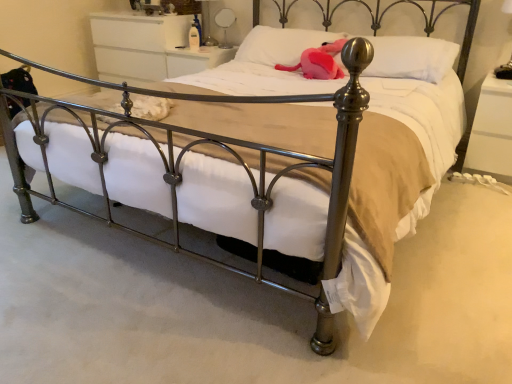
Describe the element at coordinates (281, 44) in the screenshot. I see `white soft pillow at upper center, which is counted as the 2th pillow, starting from the right` at that location.

Describe the element at coordinates (148, 48) in the screenshot. I see `white glossy dresser at upper center, which appears as the second nightstand when viewed from the front` at that location.

The image size is (512, 384). In order to click on pink plush toy at center in this screenshot , I will do `click(319, 62)`.

What is the approximate width of pink plush toy at center?

16.47 inches.

At what (x,y) coordinates should I click in order to perform the action: click on white soft pillow at upper center, the 1th pillow from the right. Please return your answer as a coordinate pair (x, y). Looking at the image, I should click on (411, 58).

Considering the sizes of objects metallic silver table lamp at upper right, which is the 1th table lamp in right-to-left order, and white glossy nightstand at right, the first nightstand positioned from the front, in the image provided, who is smaller, metallic silver table lamp at upper right, which is the 1th table lamp in right-to-left order, or white glossy nightstand at right, the first nightstand positioned from the front,?

Smaller between the two is metallic silver table lamp at upper right, which is the 1th table lamp in right-to-left order.

Can you confirm if metallic silver table lamp at upper right, positioned as the first table lamp in front-to-back order, is wider than white glossy nightstand at right, the first nightstand positioned from the front?

In fact, metallic silver table lamp at upper right, positioned as the first table lamp in front-to-back order, might be narrower than white glossy nightstand at right, the first nightstand positioned from the front.

From the image's perspective, does metallic silver table lamp at upper right, which is the second table lamp from top to bottom, appear higher than white glossy nightstand at right, the first nightstand positioned from the front?

Correct, metallic silver table lamp at upper right, which is the second table lamp from top to bottom, appears higher than white glossy nightstand at right, the first nightstand positioned from the front, in the image.

Which object is positioned more to the left, metallic silver table lamp at upper right, marked as the second table lamp in a back-to-front arrangement, or white glossy nightstand at right, the 1th nightstand when ordered from bottom to top?

From the viewer's perspective, metallic silver table lamp at upper right, marked as the second table lamp in a back-to-front arrangement, appears more on the left side.

Is metallic silver table lamp at upper center, which is counted as the first table lamp, starting from the left, not close to white soft pillow at upper center, which is counted as the second pillow, starting from the left?

Yes, metallic silver table lamp at upper center, which is counted as the first table lamp, starting from the left, and white soft pillow at upper center, which is counted as the second pillow, starting from the left, are quite far apart.

Is metallic silver table lamp at upper center, the 2th table lamp in the bottom-to-top sequence, turned away from white soft pillow at upper center, the 1th pillow from the right?

No, metallic silver table lamp at upper center, the 2th table lamp in the bottom-to-top sequence,'s orientation is not away from white soft pillow at upper center, the 1th pillow from the right.

Would you say metallic silver table lamp at upper center, arranged as the 1th table lamp when viewed from the top, is outside white soft pillow at upper center, which is counted as the second pillow, starting from the left?

Yes, metallic silver table lamp at upper center, arranged as the 1th table lamp when viewed from the top, is located beyond the bounds of white soft pillow at upper center, which is counted as the second pillow, starting from the left.

Does point (209, 31) lie in front of point (414, 68)?

No, (209, 31) is behind (414, 68).

Does metallic silver table lamp at upper right, which ranks as the first table lamp in bottom-to-top order, turn towards metallic silver table lamp at upper center, which is the 2th table lamp from front to back?

No, metallic silver table lamp at upper right, which ranks as the first table lamp in bottom-to-top order, is not aimed at metallic silver table lamp at upper center, which is the 2th table lamp from front to back.

Is metallic silver table lamp at upper right, which is the second table lamp from top to bottom, at the left side of metallic silver table lamp at upper center, which is counted as the first table lamp, starting from the left?

Incorrect, metallic silver table lamp at upper right, which is the second table lamp from top to bottom, is not on the left side of metallic silver table lamp at upper center, which is counted as the first table lamp, starting from the left.

In the scene shown: From a real-world perspective, who is located lower, metallic silver table lamp at upper right, marked as the second table lamp in a back-to-front arrangement, or metallic silver table lamp at upper center, which is the first table lamp in back-to-front order?

metallic silver table lamp at upper center, which is the first table lamp in back-to-front order.

Is metallic silver table lamp at upper right, positioned as the first table lamp in front-to-back order, inside or outside of metallic silver table lamp at upper center, the 2th table lamp in the bottom-to-top sequence?

The correct answer is: outside.

How different are the orientations of metallic silver table lamp at upper center, the 2th table lamp in the bottom-to-top sequence, and white soft pillow at upper center, acting as the 1th pillow starting from the left, in degrees?

3.68 degrees separate the facing orientations of metallic silver table lamp at upper center, the 2th table lamp in the bottom-to-top sequence, and white soft pillow at upper center, acting as the 1th pillow starting from the left.

Choose the correct answer: Is metallic silver table lamp at upper center, which is counted as the first table lamp, starting from the left, inside white soft pillow at upper center, which is counted as the 2th pillow, starting from the right, or outside it?

metallic silver table lamp at upper center, which is counted as the first table lamp, starting from the left, lies outside white soft pillow at upper center, which is counted as the 2th pillow, starting from the right.

Based on their positions, is metallic silver table lamp at upper center, which is counted as the first table lamp, starting from the left, located to the left or right of white soft pillow at upper center, which is counted as the 2th pillow, starting from the right?

Clearly, metallic silver table lamp at upper center, which is counted as the first table lamp, starting from the left, is on the left of white soft pillow at upper center, which is counted as the 2th pillow, starting from the right, in the image.

From the image's perspective, between metallic silver table lamp at upper center, which is counted as the first table lamp, starting from the left, and white soft pillow at upper center, which is counted as the 2th pillow, starting from the right, which one is located above?

metallic silver table lamp at upper center, which is counted as the first table lamp, starting from the left, from the image's perspective.

From their relative heights in the image, would you say white glossy nightstand at right, the 2th nightstand positioned from the left, is taller or shorter than white soft pillow at upper center, acting as the 1th pillow starting from the left?

Clearly, white glossy nightstand at right, the 2th nightstand positioned from the left, is taller compared to white soft pillow at upper center, acting as the 1th pillow starting from the left.

Is white glossy nightstand at right, the 2th nightstand positioned from the left, bigger or smaller than white soft pillow at upper center, acting as the 1th pillow starting from the left?

Considering their sizes, white glossy nightstand at right, the 2th nightstand positioned from the left, takes up more space than white soft pillow at upper center, acting as the 1th pillow starting from the left.

Are white glossy nightstand at right, the 1th nightstand when ordered from bottom to top, and white soft pillow at upper center, which is counted as the 2th pillow, starting from the right, located far from each other?

white glossy nightstand at right, the 1th nightstand when ordered from bottom to top, is far away from white soft pillow at upper center, which is counted as the 2th pillow, starting from the right.

From a real-world perspective, is white glossy nightstand at right, the first nightstand positioned from the front, above or below white soft pillow at upper center, acting as the 1th pillow starting from the left?

white glossy nightstand at right, the first nightstand positioned from the front, is below white soft pillow at upper center, acting as the 1th pillow starting from the left.

Which of these two, pink plush toy at center or metallic silver table lamp at upper right, positioned as the first table lamp in front-to-back order, is smaller?

metallic silver table lamp at upper right, positioned as the first table lamp in front-to-back order.

Is pink plush toy at center looking in the opposite direction of metallic silver table lamp at upper right, positioned as the first table lamp in front-to-back order?

No.

Consider the image. Which is correct: pink plush toy at center is inside metallic silver table lamp at upper right, marked as the second table lamp in a back-to-front arrangement, or outside of it?

pink plush toy at center cannot be found inside metallic silver table lamp at upper right, marked as the second table lamp in a back-to-front arrangement.

How many degrees apart are the facing directions of pink plush toy at center and metallic silver table lamp at upper right, which is the 1th table lamp in right-to-left order?

The facing directions of pink plush toy at center and metallic silver table lamp at upper right, which is the 1th table lamp in right-to-left order, are 9.26 degrees apart.

Is metallic silver table lamp at upper center, positioned as the 2th table lamp in right-to-left order, not inside white glossy dresser at upper center, which is the 2th nightstand from right to left?

Yes, metallic silver table lamp at upper center, positioned as the 2th table lamp in right-to-left order, is not within white glossy dresser at upper center, which is the 2th nightstand from right to left.

From the image's perspective, between metallic silver table lamp at upper center, positioned as the 2th table lamp in right-to-left order, and white glossy dresser at upper center, which appears as the second nightstand when viewed from the front, which one is located above?

metallic silver table lamp at upper center, positioned as the 2th table lamp in right-to-left order, appears higher in the image.

The width and height of the screenshot is (512, 384). In order to click on the 1st table lamp positioned above the white glossy dresser at upper center, which is the 2th nightstand from right to left (from a real-world perspective) in this screenshot , I will do `click(206, 23)`.

Is metallic silver table lamp at upper center, which is the first table lamp in back-to-front order, shorter than white glossy dresser at upper center, which is the 2th nightstand from right to left?

Yes.

Starting from the white glossy nightstand at right, acting as the 2th nightstand starting from the top, which table lamp is the 1st one to the left? Please provide its 2D coordinates.

[(504, 70)]

Locate an element on the screen. The height and width of the screenshot is (384, 512). pillow that is the 2nd one when counting downward from the metallic silver table lamp at upper center, which is the first table lamp in back-to-front order (from the image's perspective) is located at coordinates (411, 58).

Looking at the image, which one is located closer to white glossy nightstand at right, the 2th nightstand positioned from the left, pink plush toy at center or white soft pillow at upper center, acting as the 1th pillow starting from the left?

pink plush toy at center is positioned closer to the anchor white glossy nightstand at right, the 2th nightstand positioned from the left.

Looking at the image, which one is located closer to pink plush toy at center, metallic silver table lamp at upper center, positioned as the 2th table lamp in right-to-left order, or metallic silver table lamp at upper right, positioned as the first table lamp in front-to-back order?

metallic silver table lamp at upper right, positioned as the first table lamp in front-to-back order, is positioned closer to the anchor pink plush toy at center.

From the picture: Considering their positions, is white soft pillow at upper center, the 1th pillow from the right, positioned closer to white glossy dresser at upper center, which is counted as the second nightstand, starting from the bottom, than white soft pillow at upper center, which is counted as the 2th pillow, starting from the right?

Based on the image, white soft pillow at upper center, which is counted as the 2th pillow, starting from the right, appears to be nearer to white glossy dresser at upper center, which is counted as the second nightstand, starting from the bottom.

From the image, which object appears to be farther from white soft pillow at upper center, which is counted as the second pillow, starting from the left, metallic silver table lamp at upper right, marked as the second table lamp in a back-to-front arrangement, or metallic silver table lamp at upper center, which is counted as the first table lamp, starting from the left?

metallic silver table lamp at upper center, which is counted as the first table lamp, starting from the left, is further to white soft pillow at upper center, which is counted as the second pillow, starting from the left.

Looking at the image, which one is located further to white glossy dresser at upper center, positioned as the 1th nightstand in left-to-right order, metallic silver table lamp at upper center, positioned as the 2th table lamp in right-to-left order, or white glossy nightstand at right, the 2th nightstand positioned from the left?

Based on the image, white glossy nightstand at right, the 2th nightstand positioned from the left, appears to be further to white glossy dresser at upper center, positioned as the 1th nightstand in left-to-right order.

Estimate the real-world distances between objects in this image. Which object is closer to white soft pillow at upper center, acting as the 1th pillow starting from the left, metallic silver table lamp at upper right, positioned as the 2th table lamp in left-to-right order, or white glossy dresser at upper center, acting as the 1th nightstand starting from the top?

white glossy dresser at upper center, acting as the 1th nightstand starting from the top, lies closer to white soft pillow at upper center, acting as the 1th pillow starting from the left, than the other object.

Which object lies further to the anchor point white glossy nightstand at right, the 2th nightstand positioned from the left, white soft pillow at upper center, which is counted as the second pillow, starting from the left, or metallic silver table lamp at upper center, arranged as the 1th table lamp when viewed from the top?

metallic silver table lamp at upper center, arranged as the 1th table lamp when viewed from the top, is further to white glossy nightstand at right, the 2th nightstand positioned from the left.

Which object lies further to the anchor point white glossy dresser at upper center, which is the 2th nightstand from right to left, metallic silver table lamp at upper center, positioned as the 2th table lamp in right-to-left order, or pink plush toy at center?

Among the two, pink plush toy at center is located further to white glossy dresser at upper center, which is the 2th nightstand from right to left.

You are a GUI agent. You are given a task and a screenshot of the screen. Output one action in this format:
    pyautogui.click(x=<x>, y=<y>)
    Task: Click on the pillow between white soft pillow at upper center, acting as the 1th pillow starting from the left, and white glossy nightstand at right, acting as the 2th nightstand starting from the top
    This screenshot has height=384, width=512.
    Given the screenshot: What is the action you would take?
    pyautogui.click(x=411, y=58)

At what (x,y) coordinates should I click in order to perform the action: click on table lamp situated between white glossy dresser at upper center, which is the 2th nightstand from right to left, and white soft pillow at upper center, acting as the 1th pillow starting from the left, from left to right. Please return your answer as a coordinate pair (x, y). Looking at the image, I should click on (206, 23).

Identify the location of pillow between pink plush toy at center and white glossy nightstand at right, the first nightstand positioned from the front. (411, 58).

This screenshot has height=384, width=512. Find the location of `animal between white soft pillow at upper center, which is counted as the 2th pillow, starting from the right, and white soft pillow at upper center, the 1th pillow from the right`. animal between white soft pillow at upper center, which is counted as the 2th pillow, starting from the right, and white soft pillow at upper center, the 1th pillow from the right is located at coordinates (319, 62).